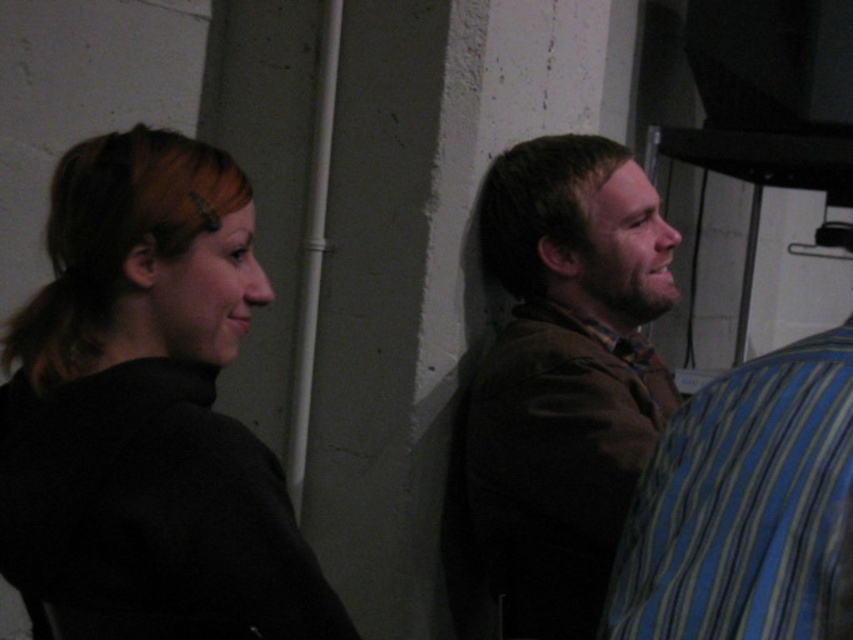
You are standing in the room and want to hand a document to the person wearing the brown fabric jacket at center. Based on their position, where should you approach from to ensure they can see you clearly?

The brown fabric jacket at center is located at point (x=556, y=388), so you should approach from the left side to ensure they can see you clearly since the person is facing towards their right where the off camera subject is.